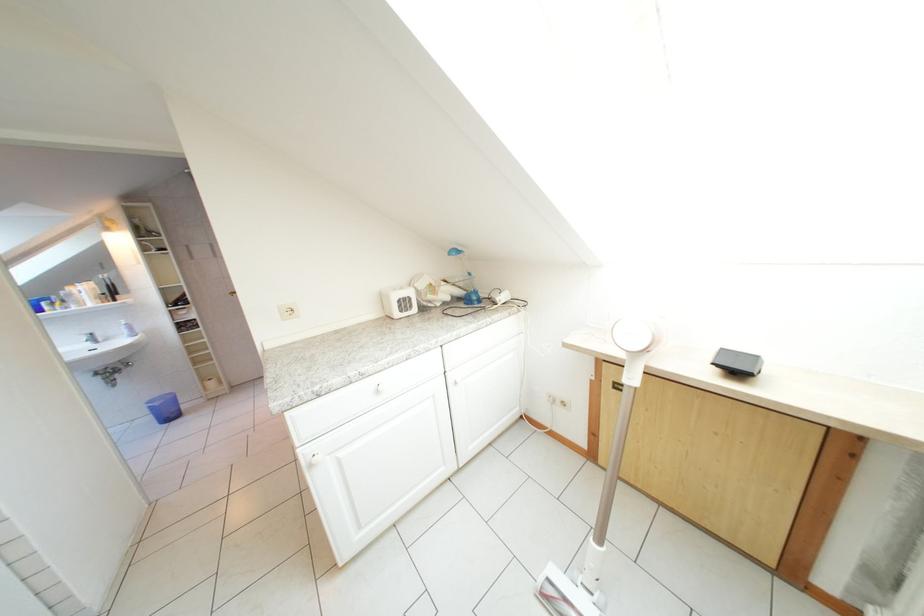
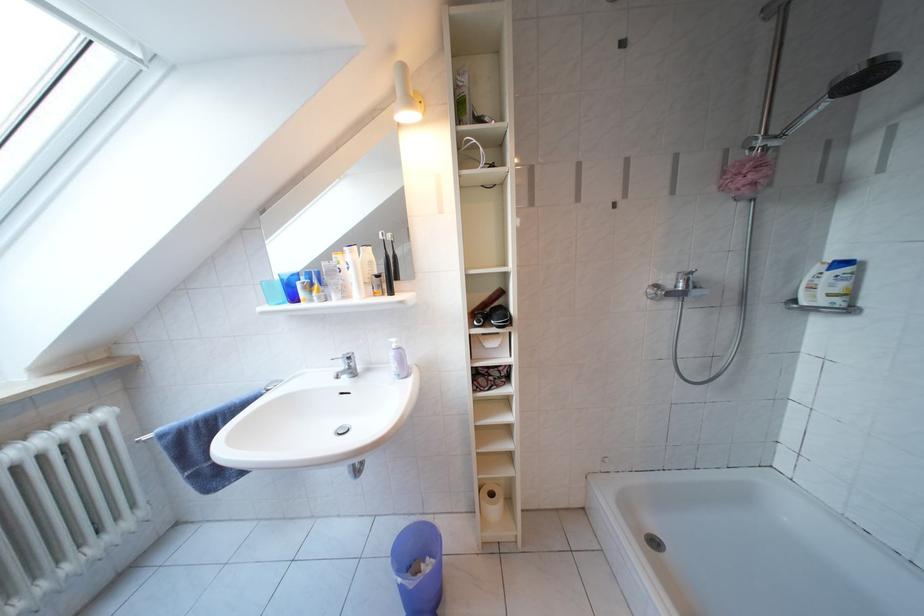
Locate, in the second image, the point that corresponds to (134,337) in the first image.

(402, 371)